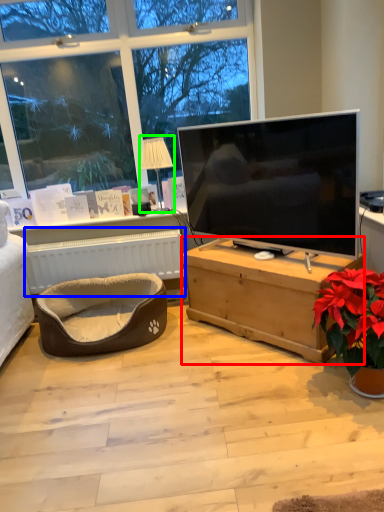
Question: Which object is the farthest from desk (highlighted by a red box)? Choose among these: radiator (highlighted by a blue box) or lamp (highlighted by a green box).

Choices:
 (A) radiator
 (B) lamp

Answer: (B)